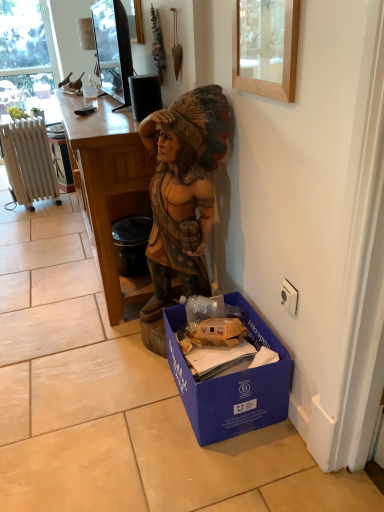
This screenshot has height=512, width=384. What do you see at coordinates (109, 188) in the screenshot?
I see `wooden desk at center` at bounding box center [109, 188].

The width and height of the screenshot is (384, 512). What are the coordinates of `wooden frame at upper center` in the screenshot? It's located at (266, 47).

What do you see at coordinates (113, 49) in the screenshot? I see `black glossy tv at upper center` at bounding box center [113, 49].

You are a GUI agent. You are given a task and a screenshot of the screen. Output one action in this format:
    pyautogui.click(x=<x>, y=<y>)
    Task: Click on the white painted metal radiator at left
    The height and width of the screenshot is (512, 384).
    Given the screenshot: What is the action you would take?
    pyautogui.click(x=29, y=162)

Where is `wooden desk at center`? The image size is (384, 512). wooden desk at center is located at coordinates click(109, 188).

Which object is thinner, wooden frame at upper center or wooden desk at center?

wooden frame at upper center is thinner.

This screenshot has width=384, height=512. There is a wooden desk at center. In order to click on picture frame above it (from a real-world perspective) in this screenshot , I will do `click(266, 47)`.

In terms of size, does wooden frame at upper center appear bigger or smaller than wooden desk at center?

In the image, wooden frame at upper center appears to be smaller than wooden desk at center.

Is wooden frame at upper center far away from wooden desk at center?

wooden frame at upper center is actually quite close to wooden desk at center.

From a real-world perspective, is white painted metal radiator at left physically below wooden desk at center?

Correct, in the physical world, white painted metal radiator at left is lower than wooden desk at center.

Is white painted metal radiator at left thinner than wooden desk at center?

Yes.

Is white painted metal radiator at left turned away from wooden desk at center?

That's not correct — white painted metal radiator at left is not looking away from wooden desk at center.

Does white painted metal radiator at left lie in front of wooden desk at center?

No, white painted metal radiator at left is behind wooden desk at center.

Is white painted metal radiator at left thinner than black glossy tv at upper center?

No.

Could you tell me if white painted metal radiator at left is facing black glossy tv at upper center?

No, white painted metal radiator at left is not aimed at black glossy tv at upper center.

Is point (10, 137) positioned behind point (118, 77)?

Yes.

The height and width of the screenshot is (512, 384). There is a white painted metal radiator at left. In order to click on television above it (from a real-world perspective) in this screenshot , I will do `click(113, 49)`.

Are black glossy tv at upper center and wooden desk at center far apart?

That's not correct — black glossy tv at upper center is a little close to wooden desk at center.

Considering their positions, is black glossy tv at upper center located in front of or behind wooden desk at center?

In the image, black glossy tv at upper center appears behind wooden desk at center.

This screenshot has height=512, width=384. Identify the location of television behind the wooden desk at center. (113, 49).

How many degrees apart are the facing directions of black glossy tv at upper center and wooden desk at center?

The angular difference between black glossy tv at upper center and wooden desk at center is 1.21 degrees.

Is wooden frame at upper center beside black glossy tv at upper center?

They are not placed beside each other.

Is wooden frame at upper center in front of or behind black glossy tv at upper center in the image?

wooden frame at upper center is in front of black glossy tv at upper center.

Is wooden frame at upper center taller or shorter than black glossy tv at upper center?

Clearly, wooden frame at upper center is shorter compared to black glossy tv at upper center.

Between wooden frame at upper center and black glossy tv at upper center, which one has smaller width?

wooden frame at upper center.

Are white painted metal radiator at left and blue cardboard box at lower right far apart?

Indeed, white painted metal radiator at left is not near blue cardboard box at lower right.

Is white painted metal radiator at left facing away from blue cardboard box at lower right?

No, white painted metal radiator at left's orientation is not away from blue cardboard box at lower right.

Considering the sizes of objects white painted metal radiator at left and blue cardboard box at lower right in the image provided, who is bigger, white painted metal radiator at left or blue cardboard box at lower right?

white painted metal radiator at left.

Choose the correct answer: Is white painted metal radiator at left inside blue cardboard box at lower right or outside it?

white painted metal radiator at left is not inside blue cardboard box at lower right, it's outside.

Identify the location of box that is on the right side of white painted metal radiator at left. (232, 382).

Considering the sizes of objects blue cardboard box at lower right and white painted metal radiator at left in the image provided, who is bigger, blue cardboard box at lower right or white painted metal radiator at left?

white painted metal radiator at left is bigger.

From their relative heights in the image, would you say blue cardboard box at lower right is taller or shorter than white painted metal radiator at left?

Considering their sizes, blue cardboard box at lower right has less height than white painted metal radiator at left.

From a real-world perspective, which is physically below, blue cardboard box at lower right or white painted metal radiator at left?

blue cardboard box at lower right, from a real-world perspective.

Find the location of a particular element. The image size is (384, 512). desk behind the wooden frame at upper center is located at coordinates (109, 188).

What are the coordinates of `desk in front of the white painted metal radiator at left` in the screenshot? It's located at (109, 188).

From the image, which object appears to be farther from wooden statue at center, black glossy tv at upper center or wooden desk at center?

Among the two, black glossy tv at upper center is located further to wooden statue at center.

Considering their positions, is white painted metal radiator at left positioned closer to blue cardboard box at lower right than wooden desk at center?

wooden desk at center lies closer to blue cardboard box at lower right than the other object.

Looking at the image, which one is located further to wooden statue at center, wooden desk at center or blue cardboard box at lower right?

Among the two, blue cardboard box at lower right is located further to wooden statue at center.

Based on their spatial positions, is wooden frame at upper center or wooden statue at center closer to white painted metal radiator at left?

Among the two, wooden statue at center is located nearer to white painted metal radiator at left.

Looking at the image, which one is located closer to white painted metal radiator at left, black glossy tv at upper center or blue cardboard box at lower right?

Among the two, black glossy tv at upper center is located nearer to white painted metal radiator at left.

From the image, which object appears to be farther from wooden desk at center, wooden statue at center or white painted metal radiator at left?

white painted metal radiator at left is positioned further to the anchor wooden desk at center.

Considering their positions, is black glossy tv at upper center positioned further to wooden statue at center than white painted metal radiator at left?

white painted metal radiator at left.

Which object lies further to the anchor point wooden statue at center, black glossy tv at upper center or wooden frame at upper center?

black glossy tv at upper center is positioned further to the anchor wooden statue at center.

Locate an element on the screen. The height and width of the screenshot is (512, 384). television between wooden frame at upper center and white painted metal radiator at left along the z-axis is located at coordinates (113, 49).

The height and width of the screenshot is (512, 384). In order to click on television between wooden desk at center and white painted metal radiator at left along the z-axis in this screenshot , I will do `click(113, 49)`.

The width and height of the screenshot is (384, 512). I want to click on person located between wooden frame at upper center and white painted metal radiator at left in the depth direction, so click(x=183, y=190).

Locate an element on the screen. The image size is (384, 512). desk between black glossy tv at upper center and blue cardboard box at lower right in the up-down direction is located at coordinates (109, 188).